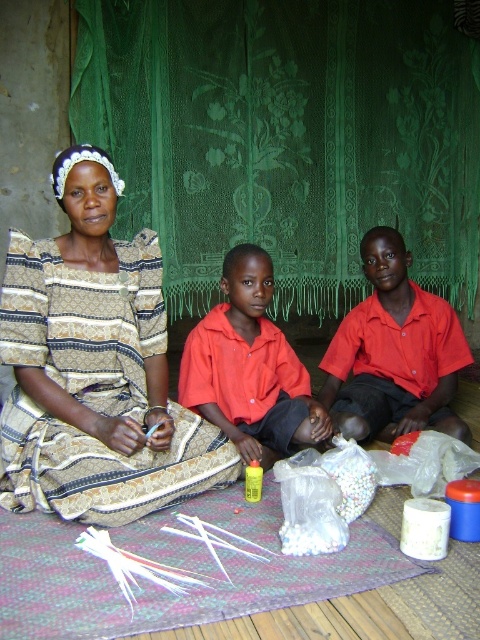
Based on the photo, you are a photographer setting up a shoot in this room. You notice two red shirts in the scene, the matte red shirt at center and the red matte shirt at center. Which one is closer to the camera?

Both objects are the same, as the red matte shirt at center is the same as the matte red shirt at center. Therefore, there is no difference in their distance from the camera.

Looking at the scene, there are two objects labeled as the matte red shirt at center and the red matte shirt at center. Which one is positioned to the right of the other?

The matte red shirt at center is to the right of the red matte shirt at center.

You are a fashion designer observing the scene. You need to determine which clothing item has a wider silhouette between the patterned fabric dress at left and the red matte shirt at center. Which one is wider?

The patterned fabric dress at left has a wider silhouette than the red matte shirt at center because its width surpasses the shirt.